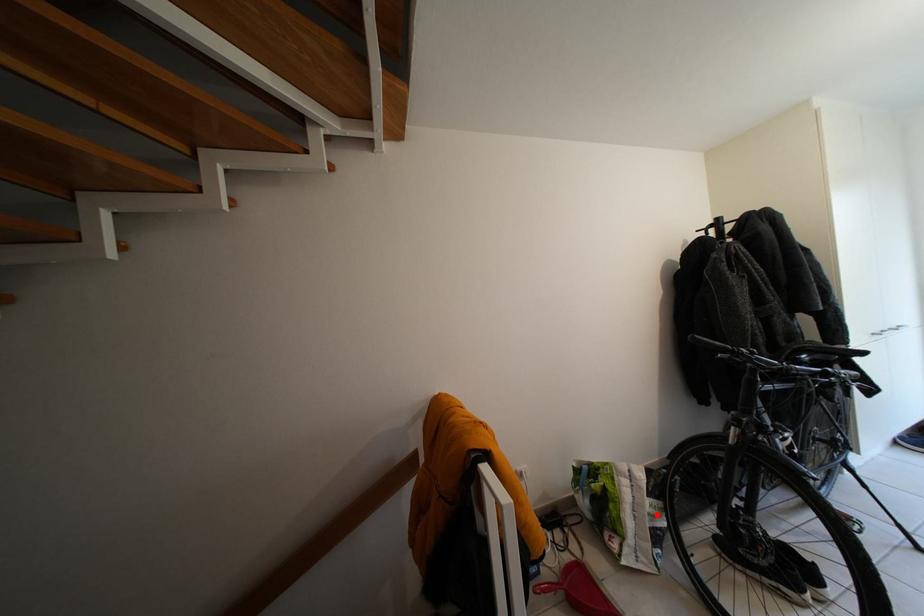
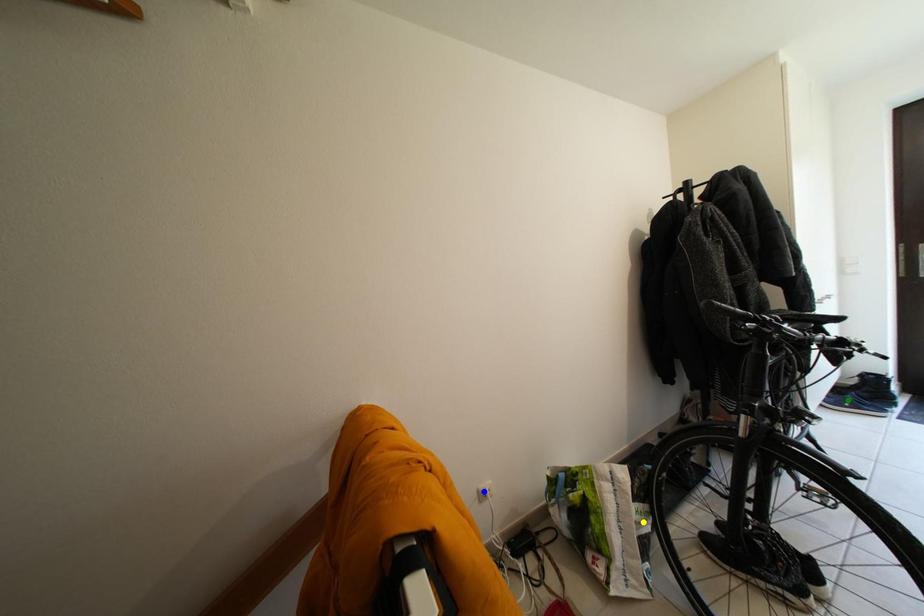
Question: I am providing you with two images of the same scene from different viewpoints. A red point is marked on the first image. You are given multiple points on the second image. Which point in image 2 represents the same 3d spot as the red point in image 1?

Choices:
 (A) blue point
 (B) green point
 (C) yellow point

Answer: (C)